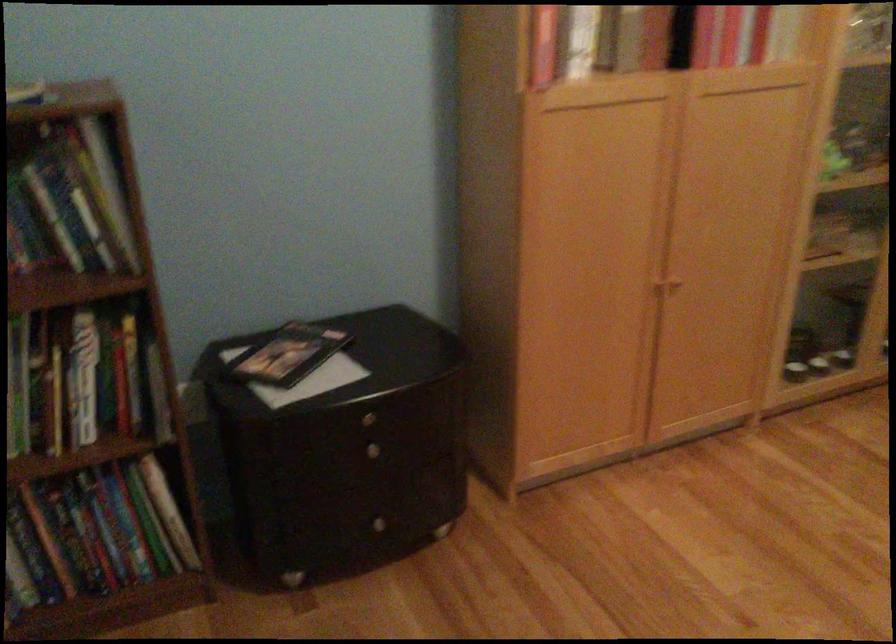
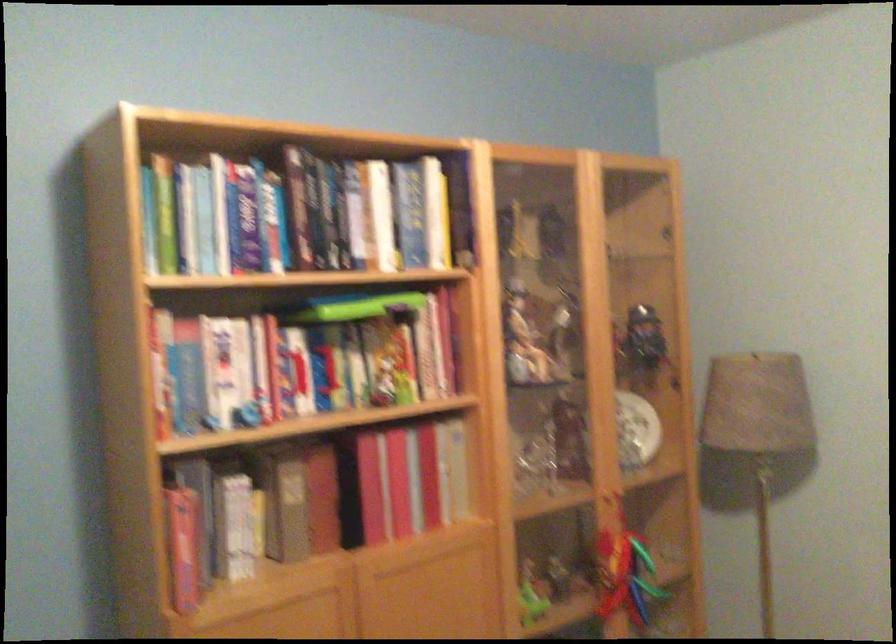
First-person continuous shooting, in which direction is the camera rotating?

The rotation direction of the camera is right-up.